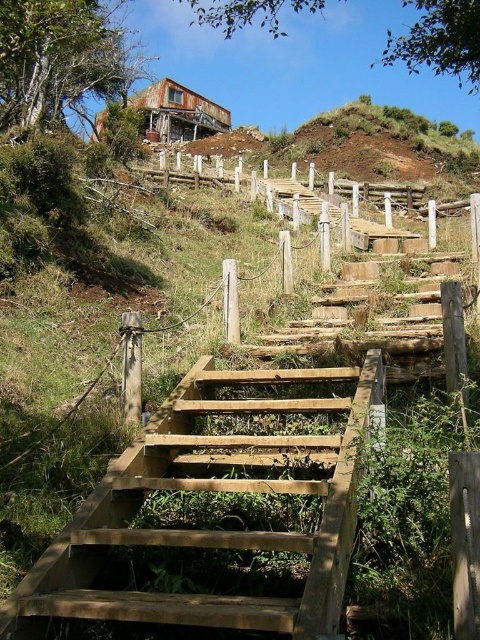
Question: Which object is closer to the camera taking this photo?

Choices:
 (A) natural wood stairs at center
 (B) wooden fence at upper center

Answer: (A)

Question: Is natural wood stairs at center bigger than wooden fence at upper center?

Choices:
 (A) yes
 (B) no

Answer: (B)

Question: Which point is closer to the camera taking this photo?

Choices:
 (A) (479, 209)
 (B) (236, 387)

Answer: (B)

Question: Is natural wood stairs at center positioned at the back of wooden fence at upper center?

Choices:
 (A) no
 (B) yes

Answer: (A)

Question: Which object is farther from the camera taking this photo?

Choices:
 (A) natural wood stairs at center
 (B) wooden fence at upper center

Answer: (B)

Question: Can you confirm if natural wood stairs at center is positioned to the left of wooden fence at upper center?

Choices:
 (A) yes
 (B) no

Answer: (A)